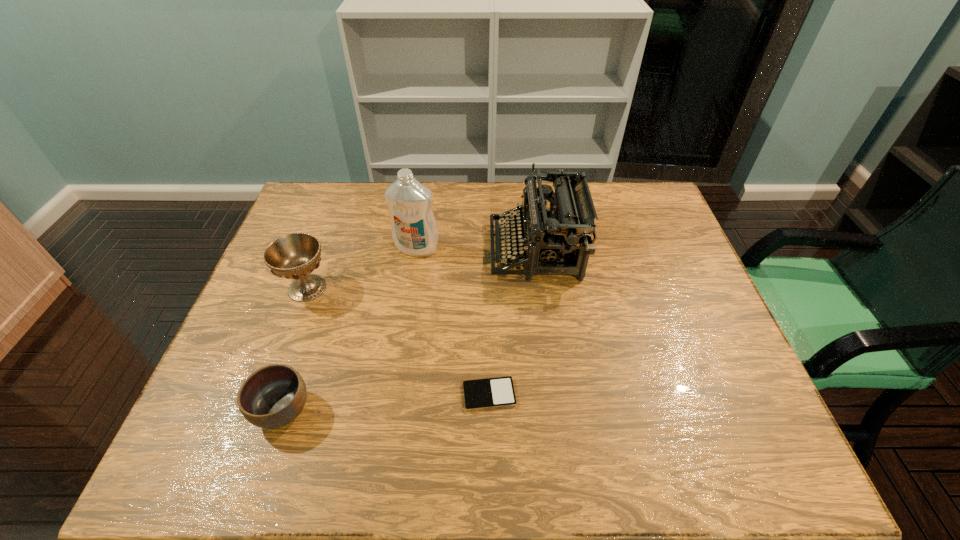
You are a GUI agent. You are given a task and a screenshot of the screen. Output one action in this format:
    pyautogui.click(x=<x>, y=<y>)
    Task: Click on the free space at the right edge of the desktop
    This screenshot has height=540, width=960.
    Given the screenshot: What is the action you would take?
    pyautogui.click(x=714, y=323)

Locate an element on the screen. This screenshot has height=540, width=960. free point at the far left corner is located at coordinates (316, 204).

The image size is (960, 540). I want to click on free spot between the fourth tallest object and the shortest object, so click(386, 402).

Identify the location of free area in between the shortest object and the bowl. The width and height of the screenshot is (960, 540). (386, 402).

Locate an element on the screen. The height and width of the screenshot is (540, 960). vacant space that is in between the fourth tallest object and the iPod is located at coordinates (386, 402).

Image resolution: width=960 pixels, height=540 pixels. In order to click on free area in between the fourth shortest object and the iPod in this screenshot , I will do `click(513, 322)`.

Find the location of `empty space between the bowl and the third object from right to left`. empty space between the bowl and the third object from right to left is located at coordinates (349, 329).

Where is `free space between the bowl and the fourth shortest object`? free space between the bowl and the fourth shortest object is located at coordinates (409, 330).

The width and height of the screenshot is (960, 540). I want to click on free spot between the bowl and the iPod, so click(386, 402).

At what (x,y) coordinates should I click in order to perform the action: click on vacant space that's between the bowl and the shortest object. Please return your answer as a coordinate pair (x, y). The height and width of the screenshot is (540, 960). Looking at the image, I should click on click(x=386, y=402).